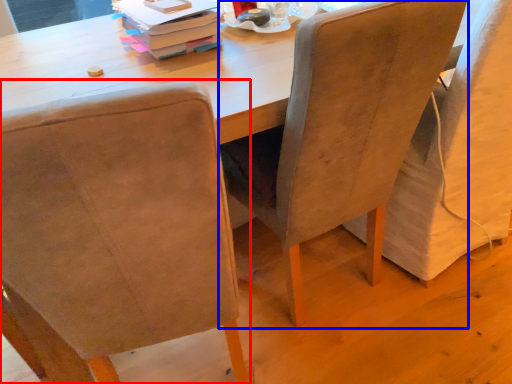
Question: Among these objects, which one is farthest to the camera, chair (highlighted by a red box) or chair (highlighted by a blue box)?

Choices:
 (A) chair
 (B) chair

Answer: (B)